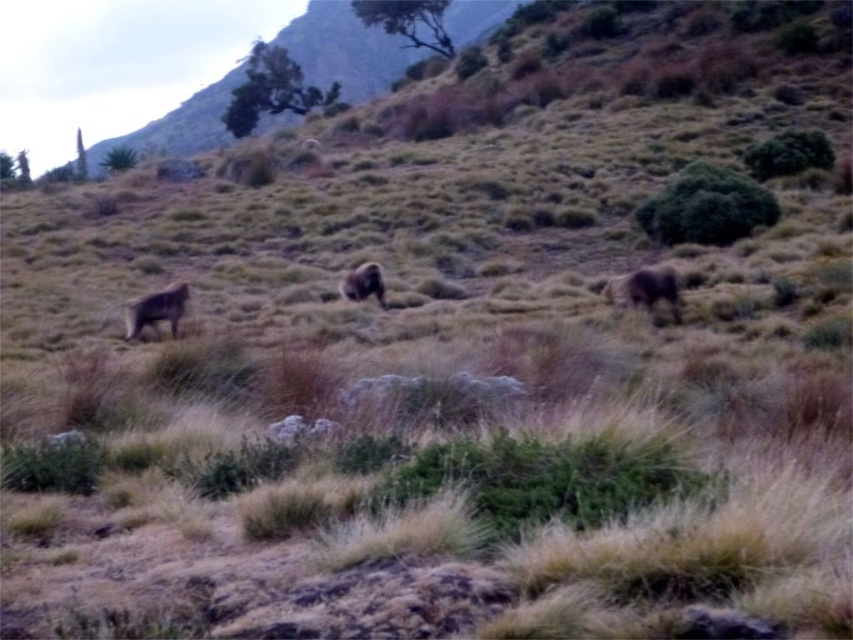
Question: Which point appears closest to the camera in this image?

Choices:
 (A) (610, 288)
 (B) (138, 300)
 (C) (345, 288)
 (D) (463, 1)

Answer: (B)

Question: Can you confirm if dry grass at upper center is smaller than brown furry animal at center?

Choices:
 (A) yes
 (B) no

Answer: (B)

Question: Where is dry grass at upper center located in relation to brown furry animal at center in the image?

Choices:
 (A) left
 (B) right

Answer: (A)

Question: Where is brown furry animal at right located in relation to fuzzy brown bear at lower left in the image?

Choices:
 (A) left
 (B) right

Answer: (B)

Question: Based on their relative distances, which object is farther from the brown furry animal at right?

Choices:
 (A) dry grass at upper center
 (B) fuzzy brown bear at lower left

Answer: (A)

Question: Which of these objects is positioned closest to the brown furry animal at right?

Choices:
 (A) dry grass at upper center
 (B) brown furry animal at center

Answer: (B)